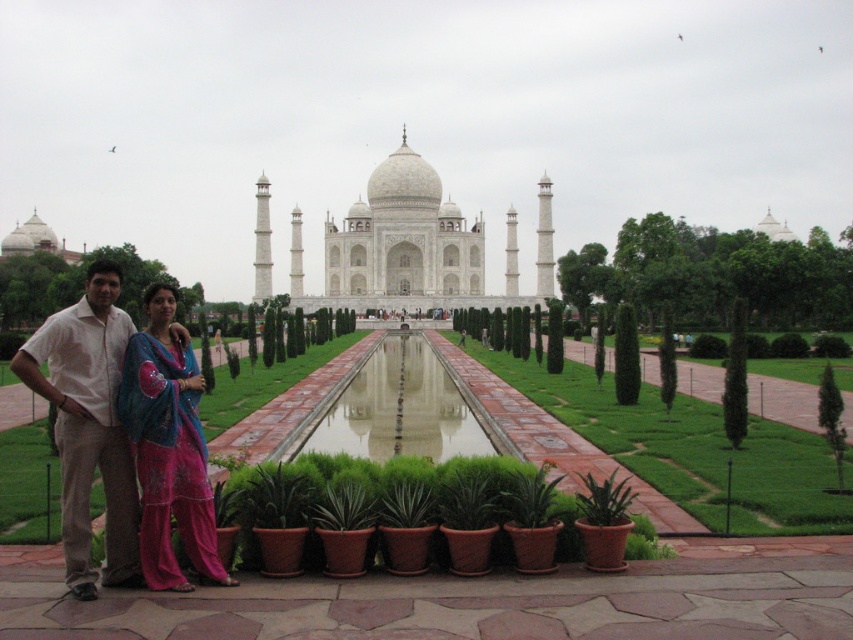
You are standing in front of the Taj Mahal and want to take a photo that includes both the point at coordinates point (x=471, y=344) and the point at coordinates point (x=190, y=451). Which point is closer to you?

Point (x=471, y=344) is further to the viewer than point (x=190, y=451), so the point at coordinates point (x=190, y=451) is closer to you.

You are visiting the Taj Mahal and notice a green leafy plant at center and a light beige cotton shirt at center in the foreground. Which object takes up more space in the image?

The light beige cotton shirt at center occupies more space than the green leafy plant at center.